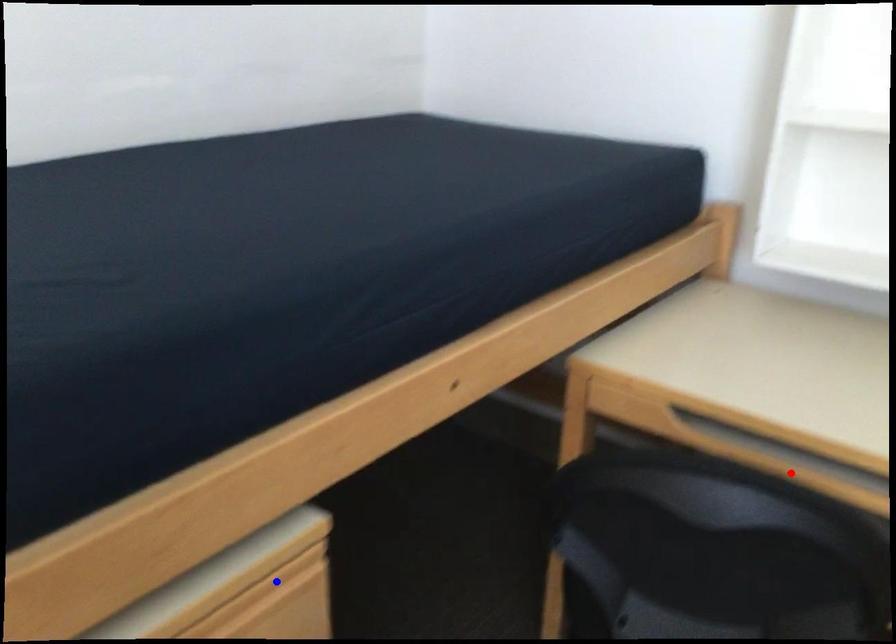
Question: In the image, two points are highlighted. Which point is nearer to the camera? Reply with the corresponding letter.

Choices:
 (A) blue point
 (B) red point

Answer: (A)